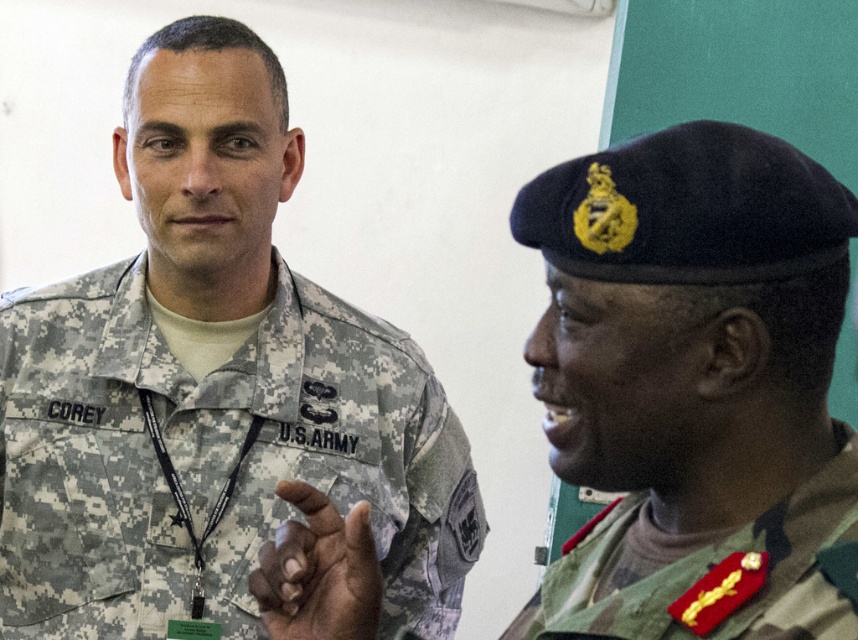
Question: Which point is closer to the camera?

Choices:
 (A) green camouflage uniform at right
 (B) camouflage fabric us army uniform at left

Answer: (A)

Question: Does camouflage fabric us army uniform at left have a greater width compared to green camouflage uniform at right?

Choices:
 (A) no
 (B) yes

Answer: (B)

Question: Can you confirm if camouflage fabric us army uniform at left is thinner than green camouflage uniform at right?

Choices:
 (A) no
 (B) yes

Answer: (A)

Question: Can you confirm if camouflage fabric us army uniform at left is positioned to the right of green camouflage uniform at right?

Choices:
 (A) yes
 (B) no

Answer: (B)